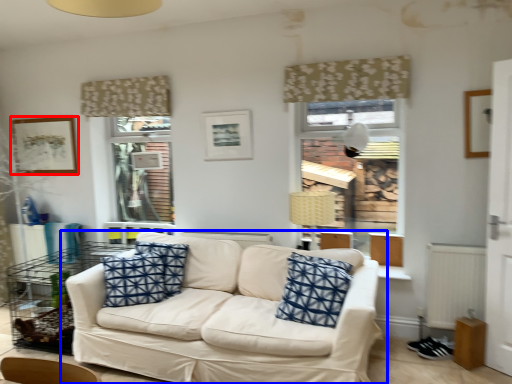
Question: Which point is further to the camera, picture frame (highlighted by a red box) or studio couch (highlighted by a blue box)?

Choices:
 (A) picture frame
 (B) studio couch

Answer: (A)